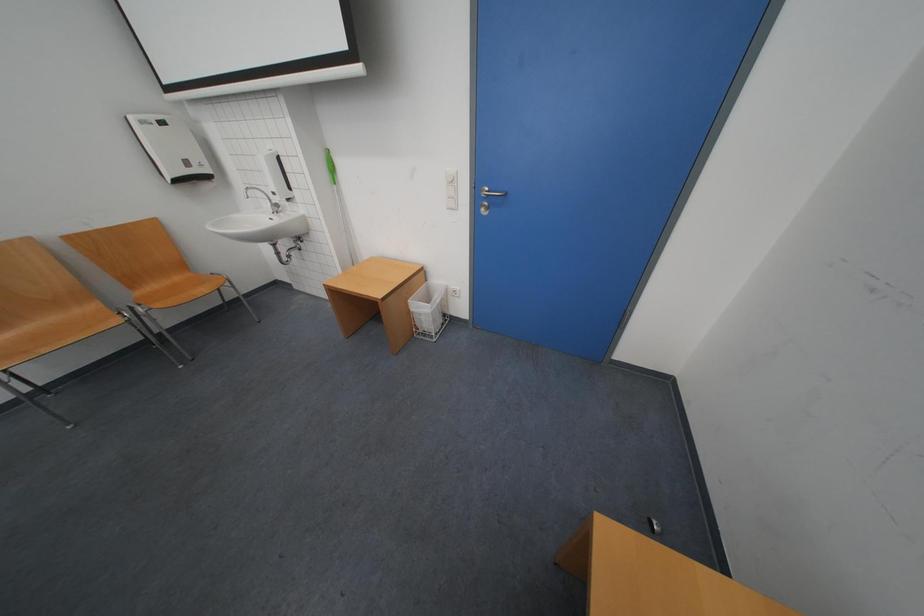
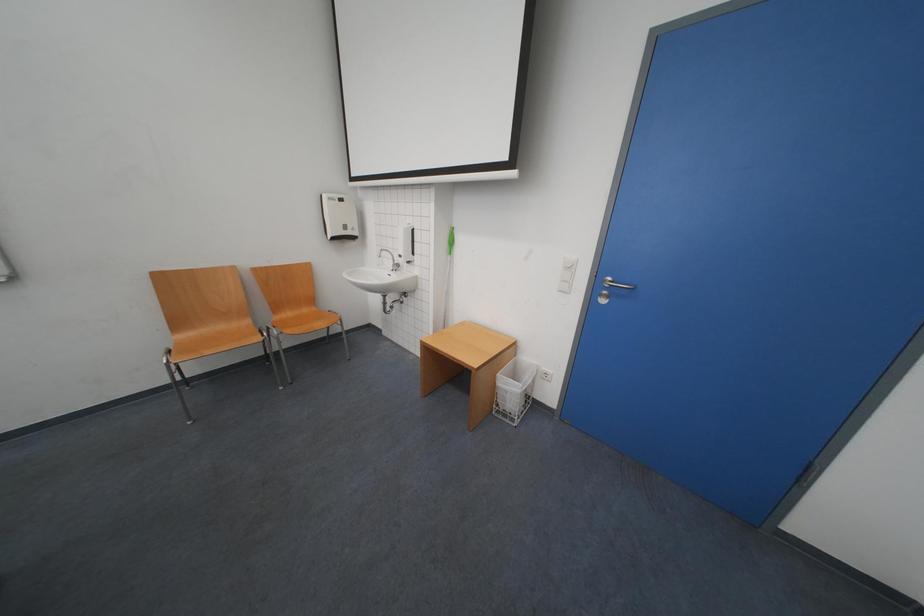
Question: The camera is either moving clockwise (left) or counter-clockwise (right) around the object. The first image is from the beginning of the video and the second image is from the end. Is the camera moving left or right when shooting the video?

Choices:
 (A) Left
 (B) Right

Answer: (B)